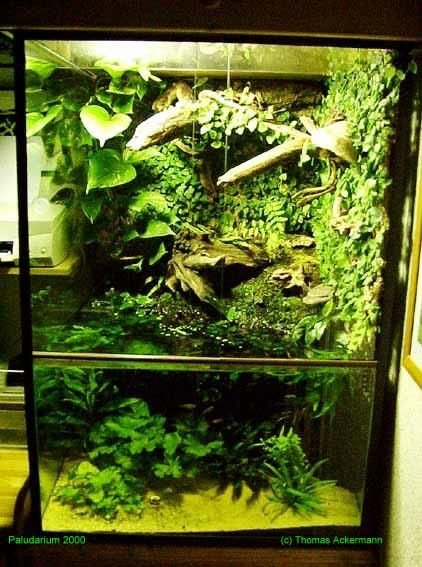
This screenshot has height=567, width=422. Identify the location of floor. tap(9, 481).